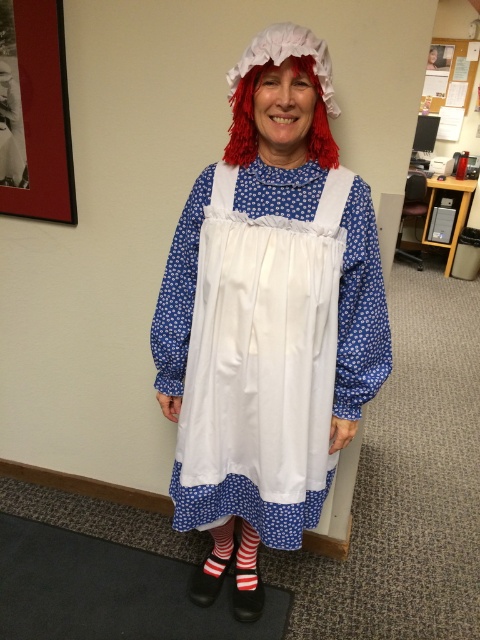
Who is more forward, [228,449] or [297,61]?

Point [297,61]

Consider the image. Which of these two, white cotton dress at center or red fluffy wig at center, stands taller?

Standing taller between the two is white cotton dress at center.

Who is more distant from viewer, (298,490) or (240,124)?

The point (298,490) is more distant.

Where is `white cotton dress at center`? Image resolution: width=480 pixels, height=640 pixels. white cotton dress at center is located at coordinates (267, 316).